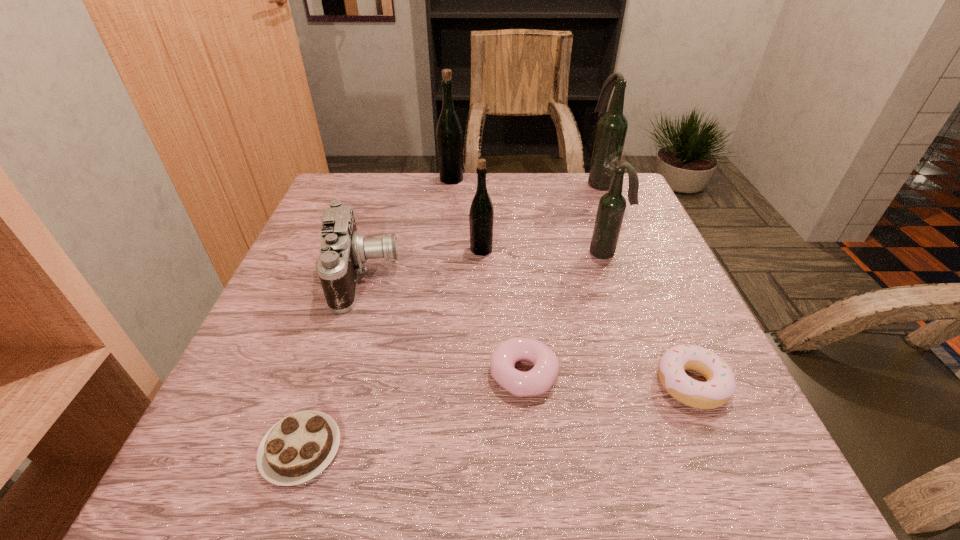
The image size is (960, 540). In the image, there is a desktop. What are the coordinates of `vacant area at the near right corner` in the screenshot? It's located at (782, 481).

I want to click on unoccupied area between the left doughnut and the nearest object, so click(413, 411).

At what (x,y) coordinates should I click in order to perform the action: click on empty space that is in between the nearest object and the purple doughnut. Please return your answer as a coordinate pair (x, y). The width and height of the screenshot is (960, 540). Looking at the image, I should click on (413, 411).

Locate an element on the screen. The height and width of the screenshot is (540, 960). vacant region between the sixth object from right to left and the camera is located at coordinates (407, 227).

At what (x,y) coordinates should I click in order to perform the action: click on empty space between the right doughnut and the leftmost beer bottle. Please return your answer as a coordinate pair (x, y). This screenshot has width=960, height=540. Looking at the image, I should click on (571, 281).

This screenshot has width=960, height=540. Identify the location of vacant area that lies between the right doughnut and the chocolate cake. (496, 416).

Identify the location of unoccupied position between the bigger dark beer bottle and the smaller green beer bottle. (540, 216).

Where is `free space between the smaller dark beer bottle and the left doughnut`? free space between the smaller dark beer bottle and the left doughnut is located at coordinates (565, 313).

Where is `vacant region between the left green beer bottle and the camera`? vacant region between the left green beer bottle and the camera is located at coordinates (407, 227).

You are a GUI agent. You are given a task and a screenshot of the screen. Output one action in this format:
    pyautogui.click(x=<x>, y=<y>)
    Task: Click on the free point between the nearer dark beer bottle and the farther green beer bottle
    
    Given the screenshot: What is the action you would take?
    pyautogui.click(x=529, y=216)